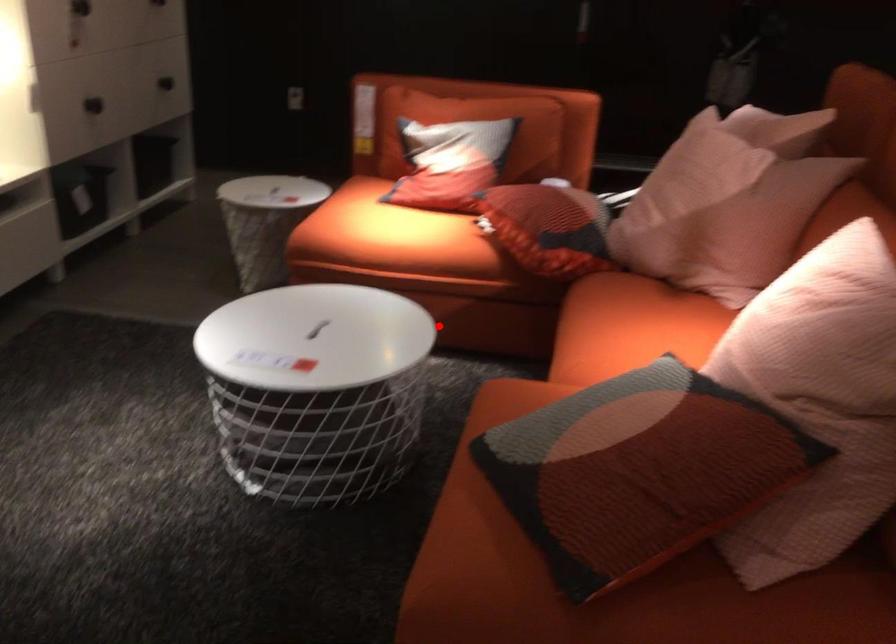
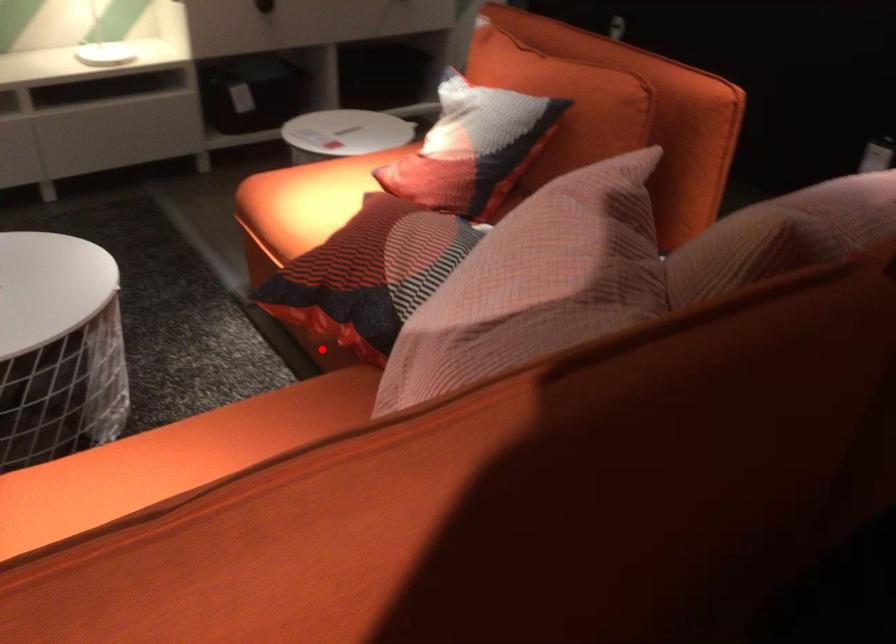
I am providing you with two images of the same scene from different viewpoints. A red point is marked on the first image and another point is marked on the second image. Does the point marked in image1 correspond to the same location as the one in image2?

Yes